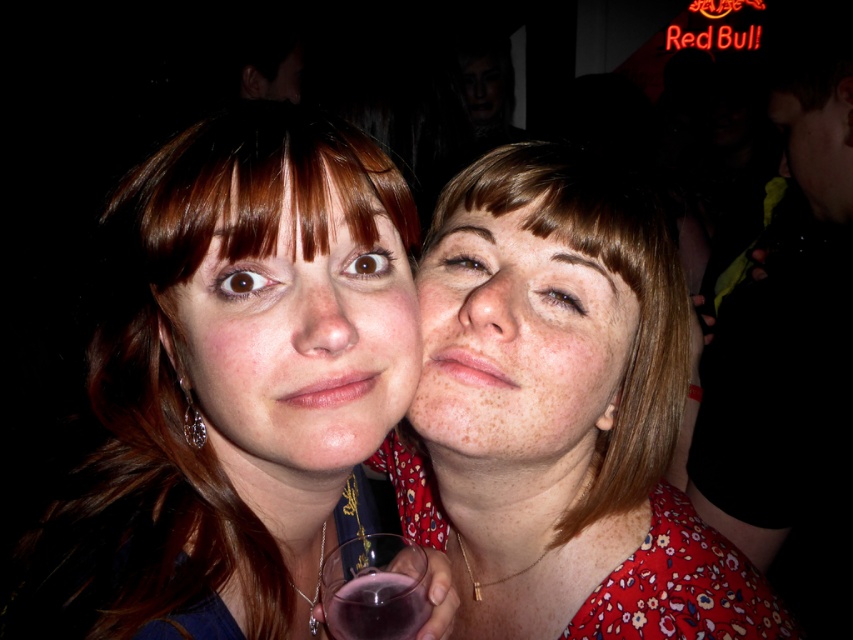
You are a photographer trying to adjust the lighting for a portrait. You have a spotlight that can only cover an area 1.2 meters wide. Given the two subjects in the image, the matte blue shirt at center and the brown matte hair at center, can the spotlight illuminate both subjects at the same time?

The matte blue shirt at center might be wider than brown matte hair at center, so the spotlight with a 1.2 meter width could potentially cover both if their combined width is within the spotlight range. However, without exact measurements, it is uncertain.

You are at a party and want to find the matte blue shirt at center. Based on the coordinates provided, where should you look in the image?

The matte blue shirt at center is located at point [235,380], so you should look towards the center of the image slightly to the right and lower middle area.